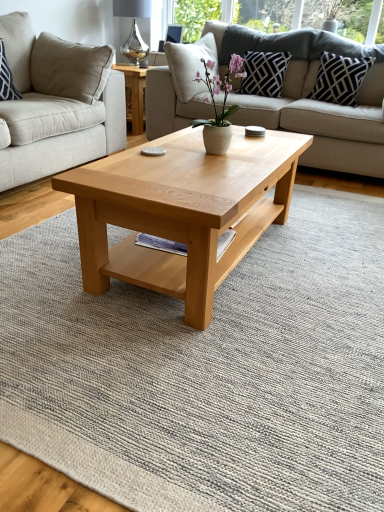
Question: Does beige fabric studio couch at center, acting as the first studio couch starting from the left, appear on the left side of light beige fabric couch at center, which is the 1th studio couch from right to left?

Choices:
 (A) no
 (B) yes

Answer: (B)

Question: Considering the relative sizes of beige fabric studio couch at center, acting as the first studio couch starting from the left, and light beige fabric couch at center, which is the 1th studio couch from right to left, in the image provided, is beige fabric studio couch at center, acting as the first studio couch starting from the left, bigger than light beige fabric couch at center, which is the 1th studio couch from right to left,?

Choices:
 (A) no
 (B) yes

Answer: (A)

Question: From the image's perspective, is beige fabric studio couch at center, the 2th studio couch viewed from the right, below light beige fabric couch at center, which is the 1th studio couch from right to left?

Choices:
 (A) yes
 (B) no

Answer: (A)

Question: Considering the relative positions of beige fabric studio couch at center, acting as the first studio couch starting from the left, and light beige fabric couch at center, which is the 1th studio couch from right to left, in the image provided, is beige fabric studio couch at center, acting as the first studio couch starting from the left, in front of light beige fabric couch at center, which is the 1th studio couch from right to left,?

Choices:
 (A) no
 (B) yes

Answer: (B)

Question: Is beige fabric studio couch at center, acting as the first studio couch starting from the left, facing away from light beige fabric couch at center, placed as the second studio couch when sorted from left to right?

Choices:
 (A) no
 (B) yes

Answer: (A)

Question: Is silver metallic lamp at upper center in front of or behind dark blue textured pillow at upper right, the second pillow in the left-to-right sequence, in the image?

Choices:
 (A) front
 (B) behind

Answer: (B)

Question: From a real-world perspective, is silver metallic lamp at upper center above or below dark blue textured pillow at upper right, acting as the second pillow starting from the right?

Choices:
 (A) below
 (B) above

Answer: (B)

Question: Choose the correct answer: Is silver metallic lamp at upper center inside dark blue textured pillow at upper right, the second pillow in the left-to-right sequence, or outside it?

Choices:
 (A) inside
 (B) outside

Answer: (B)

Question: From the image's perspective, is silver metallic lamp at upper center located above or below dark blue textured pillow at upper right, acting as the second pillow starting from the right?

Choices:
 (A) above
 (B) below

Answer: (A)

Question: Based on their sizes in the image, would you say blue and white striped pillow at upper left, acting as the first pillow starting from the left, is bigger or smaller than white matte vase at center?

Choices:
 (A) big
 (B) small

Answer: (A)

Question: In terms of height, does blue and white striped pillow at upper left, which is the 3th pillow in right-to-left order, look taller or shorter compared to white matte vase at center?

Choices:
 (A) tall
 (B) short

Answer: (A)

Question: From the image's perspective, is blue and white striped pillow at upper left, acting as the first pillow starting from the left, located above or below white matte vase at center?

Choices:
 (A) below
 (B) above

Answer: (B)

Question: Based on their positions, is blue and white striped pillow at upper left, acting as the first pillow starting from the left, located to the left or right of white matte vase at center?

Choices:
 (A) left
 (B) right

Answer: (A)

Question: Is blue and white striped pillow at upper left, which is the 3th pillow in right-to-left order, bigger or smaller than dark blue geometric-patterned pillow at upper right, placed as the first pillow when sorted from right to left?

Choices:
 (A) small
 (B) big

Answer: (A)

Question: Visually, is blue and white striped pillow at upper left, acting as the first pillow starting from the left, positioned to the left or to the right of dark blue geometric-patterned pillow at upper right, placed as the 3th pillow when sorted from left to right?

Choices:
 (A) right
 (B) left

Answer: (B)